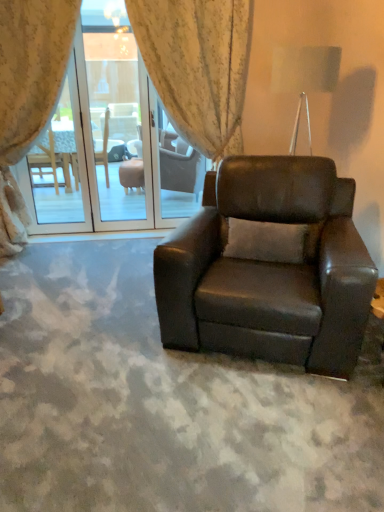
Question: From a real-world perspective, is matte black armchair at center over transparent glass screen door at center?

Choices:
 (A) no
 (B) yes

Answer: (A)

Question: Is matte black armchair at center outside of transparent glass screen door at center?

Choices:
 (A) yes
 (B) no

Answer: (A)

Question: From the image's perspective, is matte black armchair at center located above transparent glass screen door at center?

Choices:
 (A) no
 (B) yes

Answer: (A)

Question: Is matte black armchair at center taller than transparent glass screen door at center?

Choices:
 (A) no
 (B) yes

Answer: (A)

Question: Does matte black armchair at center have a lesser width compared to transparent glass screen door at center?

Choices:
 (A) no
 (B) yes

Answer: (A)

Question: Is matte black armchair at center facing towards transparent glass screen door at center?

Choices:
 (A) no
 (B) yes

Answer: (A)

Question: Can you confirm if floral fabric curtain at center, which is the first curtain in right-to-left order, is shorter than transparent glass screen door at center?

Choices:
 (A) yes
 (B) no

Answer: (B)

Question: Does floral fabric curtain at center, which is the first curtain in right-to-left order, have a larger size compared to transparent glass screen door at center?

Choices:
 (A) yes
 (B) no

Answer: (A)

Question: Is the depth of floral fabric curtain at center, which is the first curtain in right-to-left order, less than that of transparent glass screen door at center?

Choices:
 (A) no
 (B) yes

Answer: (B)

Question: Does floral fabric curtain at center, the second curtain viewed from the left, appear on the left side of transparent glass screen door at center?

Choices:
 (A) no
 (B) yes

Answer: (A)

Question: Is floral fabric curtain at center, the second curtain viewed from the left, surrounding transparent glass screen door at center?

Choices:
 (A) no
 (B) yes

Answer: (A)

Question: Is floral fabric curtain at center, the second curtain viewed from the left, facing towards transparent glass screen door at center?

Choices:
 (A) no
 (B) yes

Answer: (A)

Question: Is transparent glass screen door at center completely or partially inside floral fabric curtain at upper left, which appears as the second curtain when viewed from the right?

Choices:
 (A) no
 (B) yes

Answer: (A)